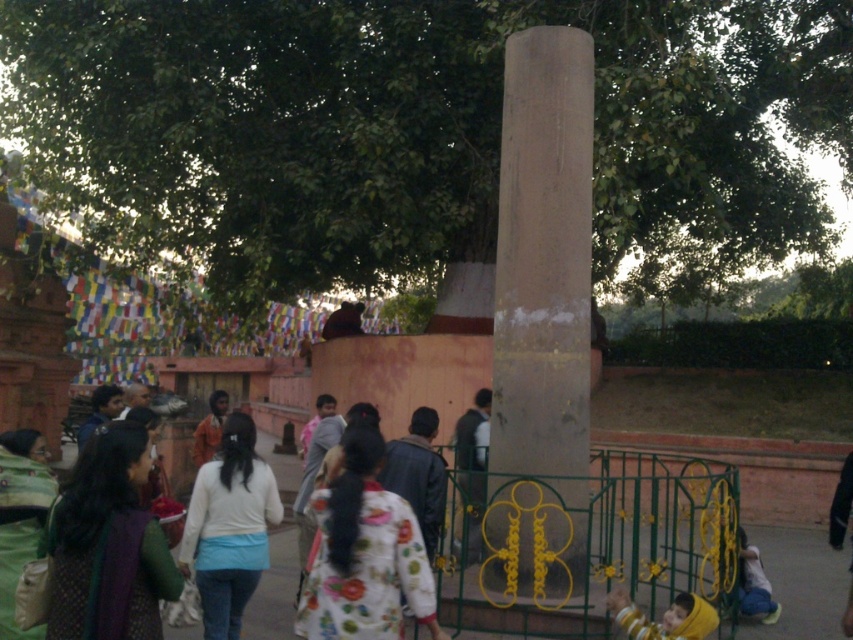
You are a photographer trying to capture a group photo of the two people wearing the white matte shirt at center and orange fabric shirt at center. The camera you have can only focus on subjects within a 10 feet range. Will both subjects be in focus if they stand where they are?

The white matte shirt at center and orange fabric shirt at center are 12.22 feet apart from each other. Since the camera can only focus within a 10 feet range, the distance between them exceeds the focus range. Therefore, both subjects might not be in focus simultaneously.